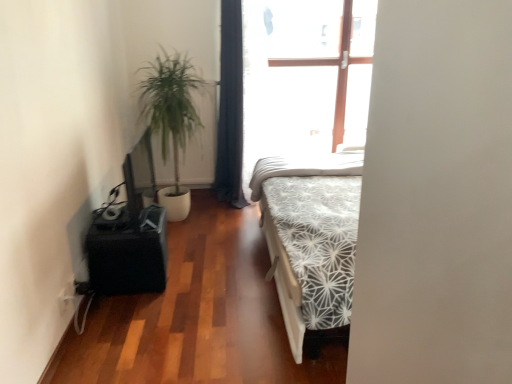
The width and height of the screenshot is (512, 384). What are the coordinates of `vacant space to the right of black matte table at left` in the screenshot? It's located at (195, 275).